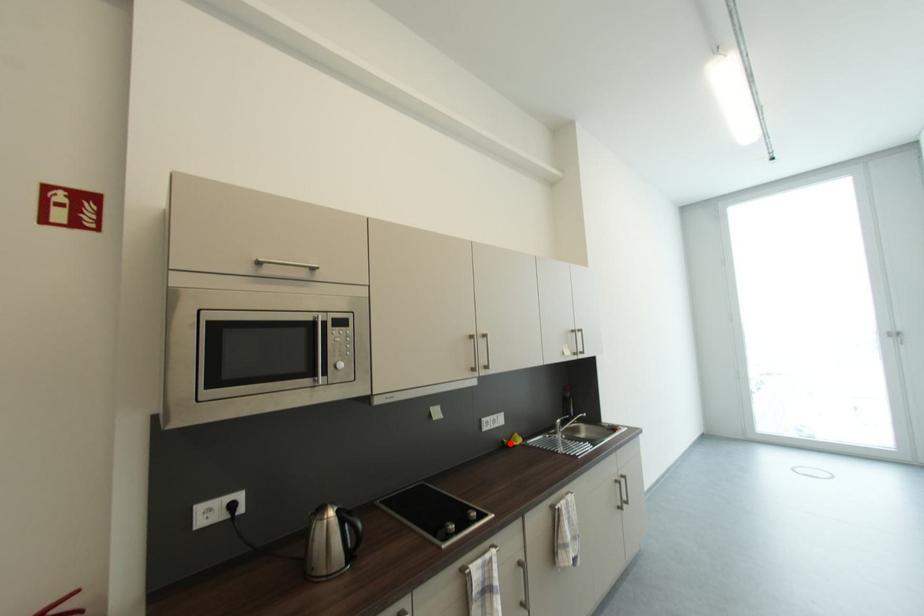
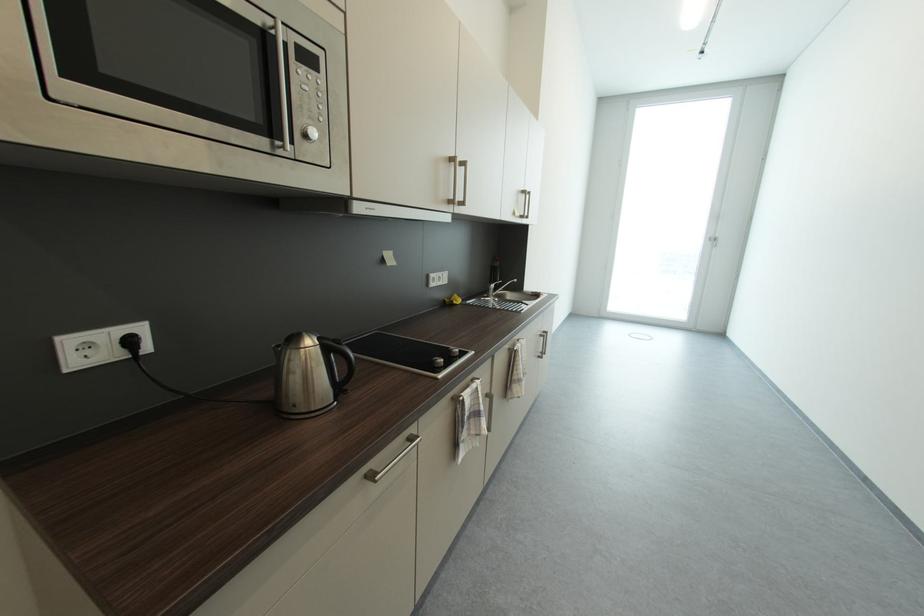
The point at the highlighted location is marked in the first image. Where is the corresponding point in the second image?

(453, 302)